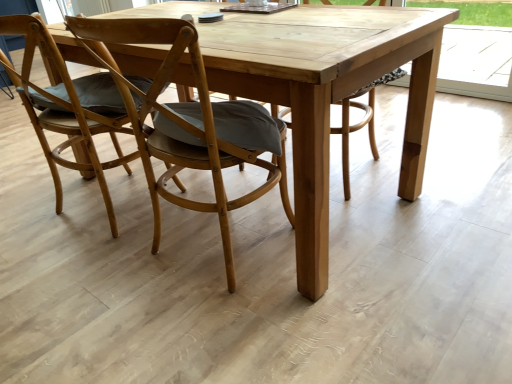
This screenshot has width=512, height=384. I want to click on free location in front of wooden chair at left, positioned as the 1th chair in left-to-right order, so click(80, 287).